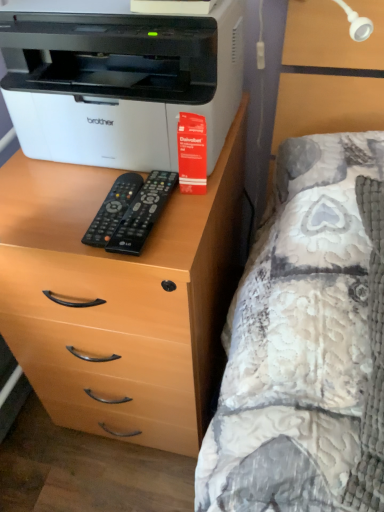
Where is `blank area to the left of black plastic remote at center, the first remote when ordered from right to left`? This screenshot has height=512, width=384. blank area to the left of black plastic remote at center, the first remote when ordered from right to left is located at coordinates (53, 213).